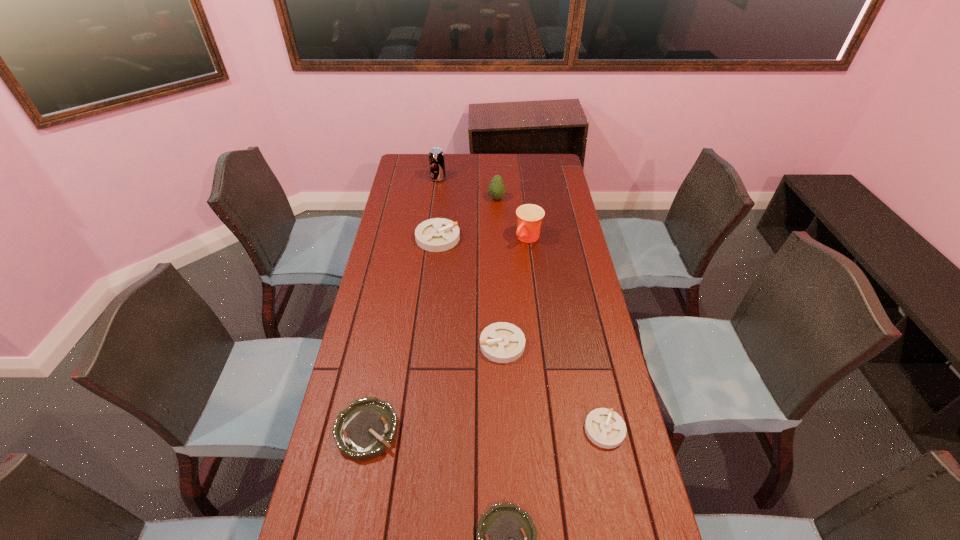
Locate an element on the screen. object located in the far edge section of the desktop is located at coordinates tap(436, 156).

Where is `cup present at the right edge`? This screenshot has height=540, width=960. cup present at the right edge is located at coordinates (529, 216).

Locate an element on the screen. The height and width of the screenshot is (540, 960). ashtray that is at the right edge is located at coordinates (605, 428).

In order to click on vacant space at the left edge of the desktop in this screenshot , I will do `click(395, 202)`.

The width and height of the screenshot is (960, 540). In the image, there is a desktop. In order to click on free space at the right edge in this screenshot , I will do `click(551, 202)`.

Find the location of a particular element. free location at the far left corner of the desktop is located at coordinates (428, 155).

In order to click on blank region between the avocado and the farthest gray ashtray in this screenshot , I will do `click(468, 218)`.

At what (x,y) coordinates should I click in order to perform the action: click on vacant space that's between the fourth nearest ashtray and the farthest object. Please return your answer as a coordinate pair (x, y). Looking at the image, I should click on (470, 262).

Identify the location of free spot between the rightmost gray ashtray and the farthest object. point(521,304).

Where is `free spot between the cup and the second farthest gray ashtray`? The image size is (960, 540). free spot between the cup and the second farthest gray ashtray is located at coordinates (516, 292).